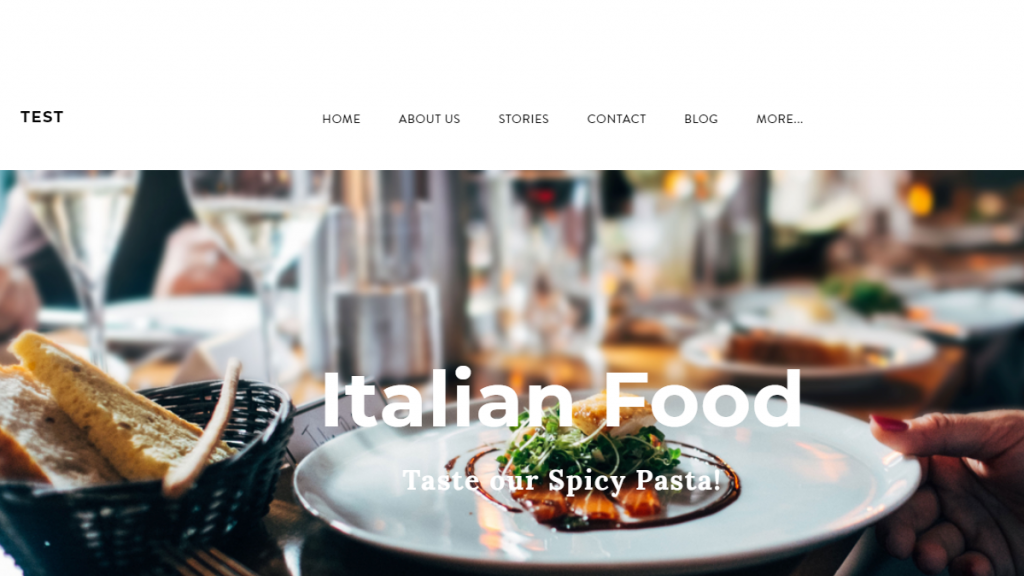
This screenshot has width=1024, height=576. In order to click on wine glass in this screenshot , I will do `click(246, 223)`, `click(103, 222)`.